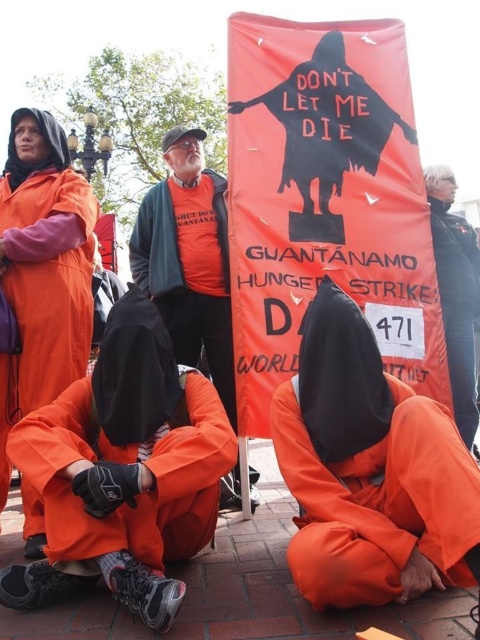
You are a photographer standing at the scene of a protest. You want to take a closeup photo of the orange cotton shirt at center. The camera you are using has a minimum focusing distance of 3 meters. Can you take the photo without moving closer?

The orange cotton shirt at center is 4.10 meters away from the camera. Since the minimum focusing distance is 3 meters, you can take the closeup photo without moving closer because the distance is within the camera range.

In the protest scene described, where is the orange cotton shirt at center located relative to the orange fabric shirt at upper right?

The orange cotton shirt at center is to the left of the orange fabric shirt at upper right.